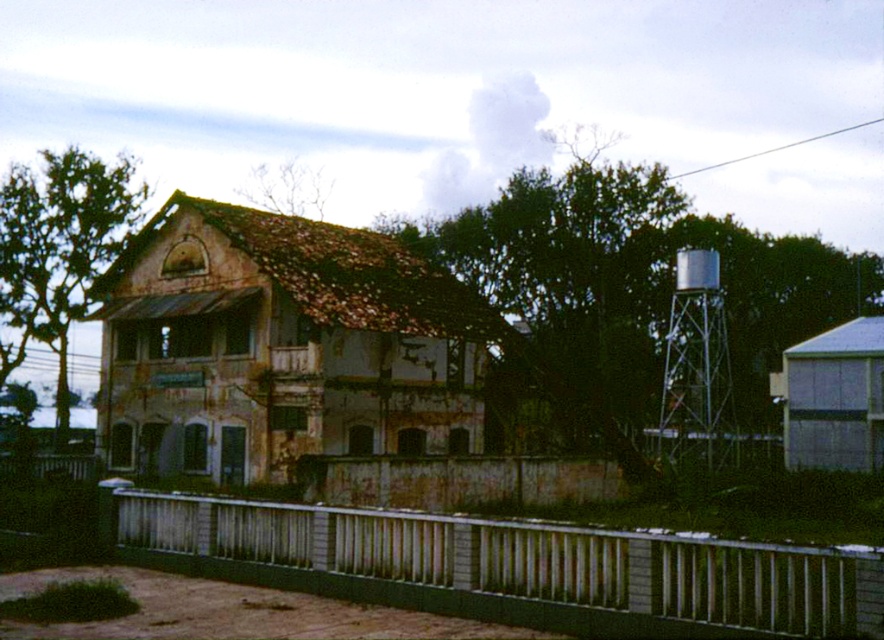
You are standing in front of the old building and want to walk towards the silver metallic water tower at right. Which direction should you move relative to the white painted metal fence at lower center?

You should move to the right of the white painted metal fence at lower center to reach the silver metallic water tower at right since the white painted metal fence at lower center is positioned to the left of the silver metallic water tower at right.